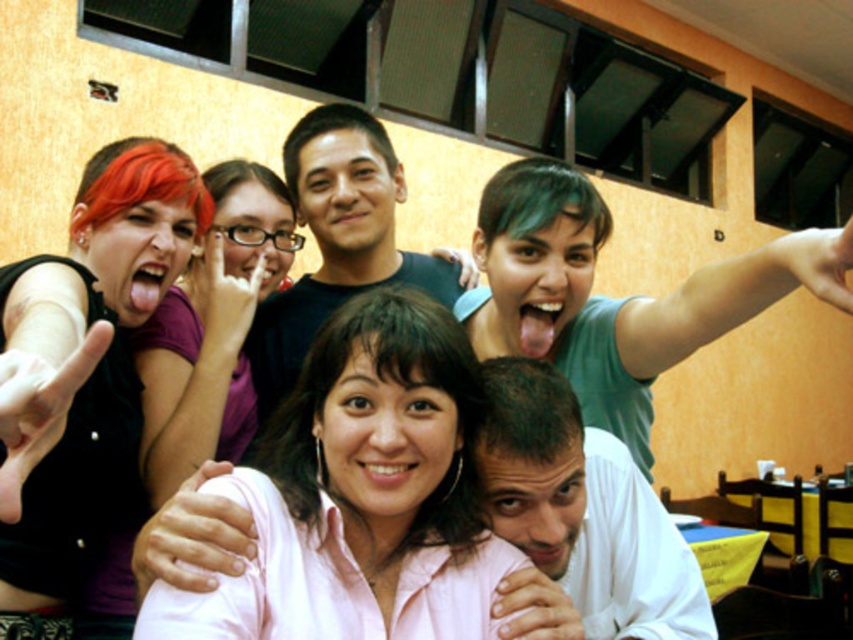
Which is in front, point (251, 291) or point (262, 276)?

Point (251, 291) is in front.

Can you confirm if matte purple shirt at left is thinner than clear plastic glasses at center?

In fact, matte purple shirt at left might be wider than clear plastic glasses at center.

The image size is (853, 640). What do you see at coordinates (212, 330) in the screenshot?
I see `matte purple shirt at left` at bounding box center [212, 330].

This screenshot has width=853, height=640. Find the location of `matte purple shirt at left`. matte purple shirt at left is located at coordinates (212, 330).

The image size is (853, 640). What do you see at coordinates (82, 369) in the screenshot?
I see `shiny black shirt at left` at bounding box center [82, 369].

Does shiny black shirt at left have a lesser width compared to smooth skin hand at center?

In fact, shiny black shirt at left might be wider than smooth skin hand at center.

Does point (55, 621) come in front of point (527, 612)?

No.

At what (x,y) coordinates should I click in order to perform the action: click on shiny black shirt at left. Please return your answer as a coordinate pair (x, y). The width and height of the screenshot is (853, 640). Looking at the image, I should click on (82, 369).

Who is lower down, black matte shirt at center or clear plastic glasses at center?

clear plastic glasses at center is below.

Who is positioned more to the right, black matte shirt at center or clear plastic glasses at center?

Positioned to the right is black matte shirt at center.

Does point (302, 326) lie in front of point (196, 298)?

No.

The image size is (853, 640). Find the location of `black matte shirt at center`. black matte shirt at center is located at coordinates (335, 240).